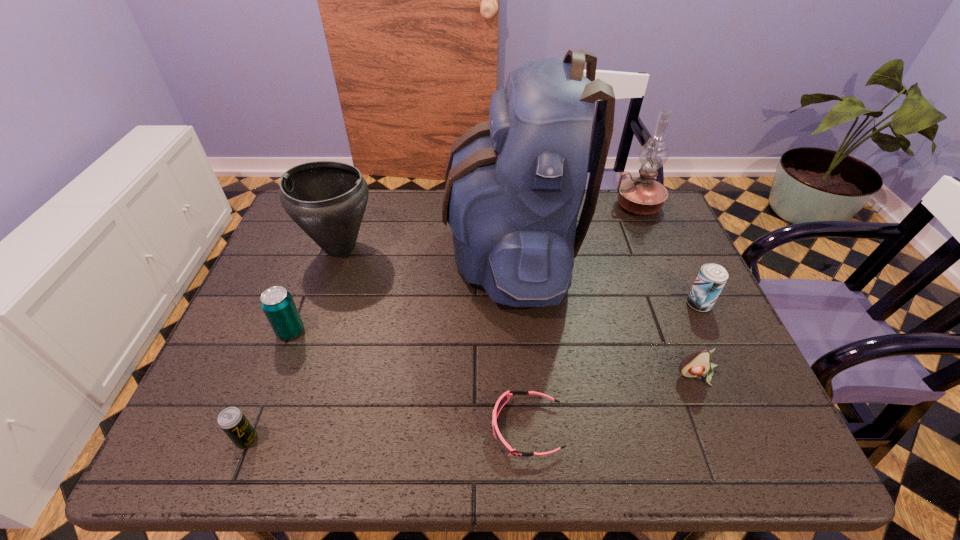
Image resolution: width=960 pixels, height=540 pixels. In order to click on free space located at the front pocket of the backpack in this screenshot , I will do `click(420, 249)`.

Find the location of a particular element. Image resolution: width=960 pixels, height=540 pixels. vacant space situated 0.140m on the left of the oil lamp is located at coordinates pos(570,206).

Identify the location of vacant space located on the right of the urn. The image size is (960, 540). (497, 247).

What are the coordinates of `free space located on the back of the second farthest beer can` in the screenshot? It's located at (333, 220).

This screenshot has width=960, height=540. Identify the location of vacant area situated on the left of the farthest beer can. tap(659, 304).

Find the location of `vacant point located 0.140m on the seed side of the sixth farthest object`. vacant point located 0.140m on the seed side of the sixth farthest object is located at coordinates (727, 450).

Where is `free spot located 0.120m on the back of the shortest beer can`? This screenshot has height=540, width=960. free spot located 0.120m on the back of the shortest beer can is located at coordinates (271, 377).

I want to click on free point located 0.280m on the front-facing side of the shortest object, so click(352, 428).

Identify the location of free location located 0.110m on the front-facing side of the shortest object. (437, 428).

Identify the location of vacant region located 0.230m on the front-facing side of the shortest object. The height and width of the screenshot is (540, 960). (377, 428).